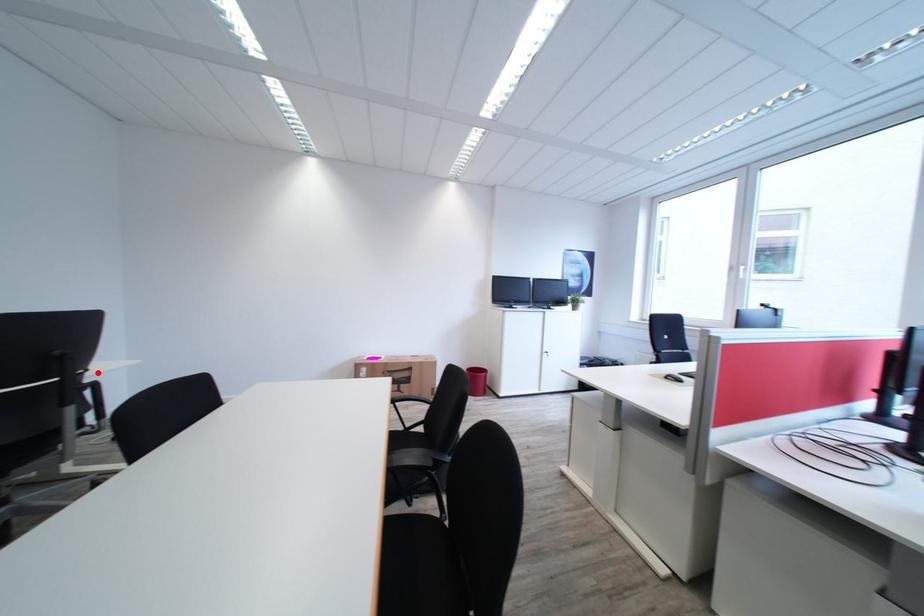
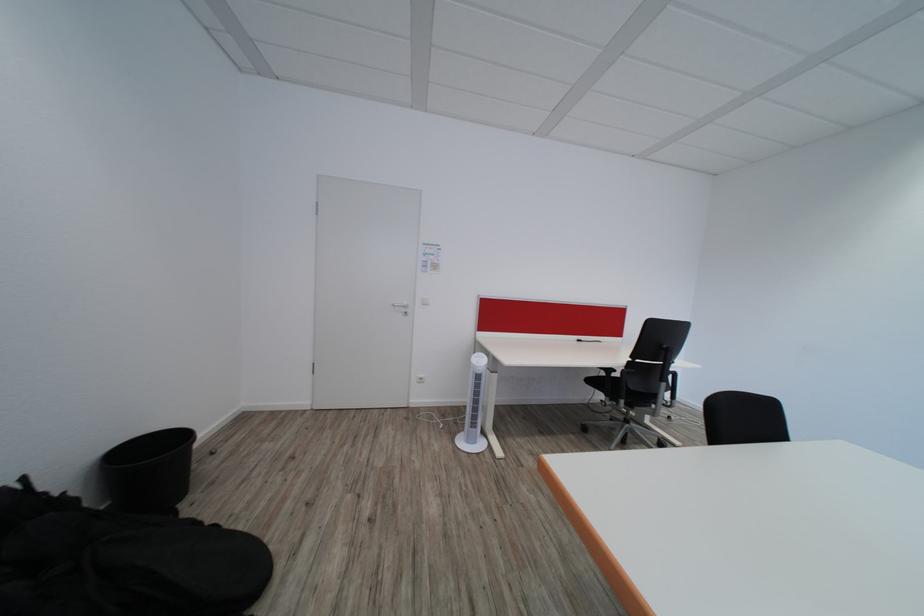
Where in the second image is the point corresponding to the highlighted location from the first image?

(684, 365)